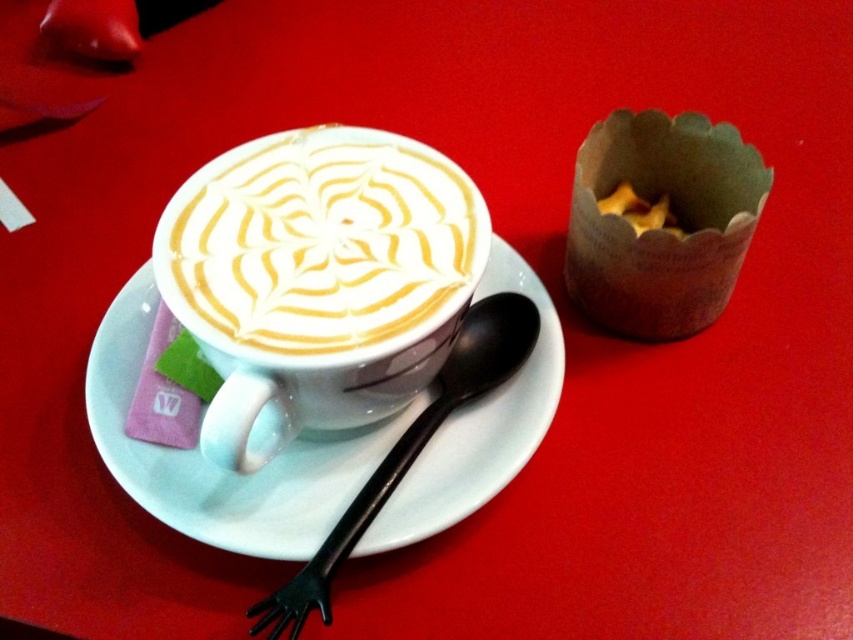
Looking at this image, who is more forward, (281, 348) or (144, 460)?

Point (281, 348) is in front.

Is white glossy cup at center to the right of white glossy saucer at center from the viewer's perspective?

Indeed, white glossy cup at center is positioned on the right side of white glossy saucer at center.

Is point (366, 205) positioned after point (514, 285)?

No, it is not.

Where is `white glossy cup at center`? white glossy cup at center is located at coordinates (318, 243).

Between white glossy saucer at center and black plastic spoon at center, which one is positioned higher?

white glossy saucer at center is higher up.

Between point (224, 515) and point (527, 353), which one is positioned in front?

Point (224, 515) is in front.

At what (x,y) coordinates should I click in order to perform the action: click on white glossy saucer at center. Please return your answer as a coordinate pair (x, y). Image resolution: width=853 pixels, height=640 pixels. Looking at the image, I should click on (216, 465).

Does brown paper muffin at upper right appear on the right side of black plastic spoon at center?

Yes, brown paper muffin at upper right is to the right of black plastic spoon at center.

Between brown paper muffin at upper right and black plastic spoon at center, which one appears on the left side from the viewer's perspective?

black plastic spoon at center is more to the left.

This screenshot has height=640, width=853. Find the location of `brown paper muffin at upper right`. brown paper muffin at upper right is located at coordinates (660, 228).